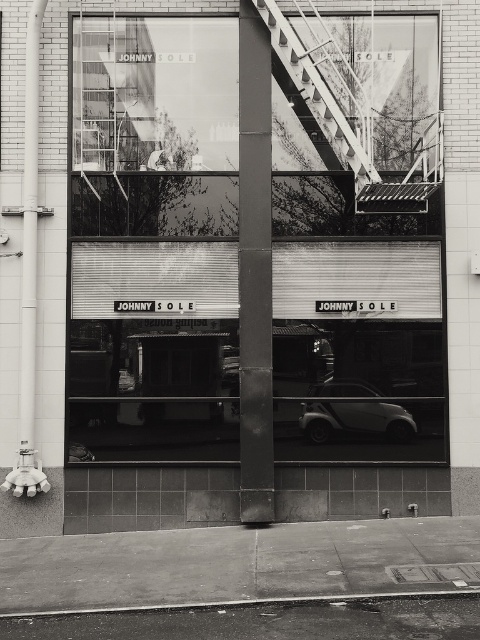
You are standing in front of the storefront and see two points marked on the glass windows. The first point is at coordinate point [176,193] and the second is at point [283,26]. Which point is closer to you?

Point [283,26] is closer to you because it is in front of point [176,193].

You are a delivery person trying to decide whether to park your van on the metallic staircase at upper center or the smooth concrete curb at lower center. Based on their sizes, which location would be more suitable for parking?

The metallic staircase at upper center is bigger than the smooth concrete curb at lower center, so parking the van would be more suitable on the metallic staircase at upper center since it has more space.

You are a delivery person trying to unload a package that requires a step higher than the smooth concrete curb at lower center. Is the metallic staircase at upper center a suitable option for reaching a higher height?

The metallic staircase at upper center is taller than the smooth concrete curb at lower center, so yes, it can provide the necessary height for unloading the package.